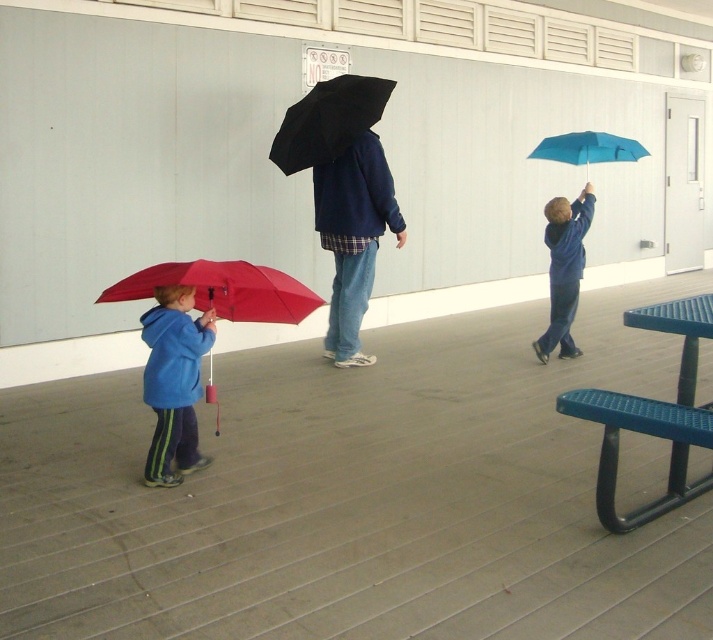
Question: Is matte red umbrella at lower left to the right of blue matte jacket at upper right from the viewer's perspective?

Choices:
 (A) yes
 (B) no

Answer: (B)

Question: Which point appears closest to the camera in this image?

Choices:
 (A) (174, 355)
 (B) (374, 193)
 (C) (150, 268)

Answer: (C)

Question: Is matte blue jacket at lower left to the right of matte red umbrella at lower left from the viewer's perspective?

Choices:
 (A) no
 (B) yes

Answer: (A)

Question: Does matte red umbrella at lower left appear under blue matte jacket at upper right?

Choices:
 (A) yes
 (B) no

Answer: (A)

Question: Which point is farther to the camera?

Choices:
 (A) matte red umbrella at lower left
 (B) black matte umbrella at center
 (C) matte blue jacket at lower left

Answer: (B)

Question: Estimate the real-world distances between objects in this image. Which object is closer to the matte blue jacket at lower left?

Choices:
 (A) matte blue hoodie at center
 (B) black matte umbrella at center
 (C) blue matte jacket at upper right

Answer: (A)